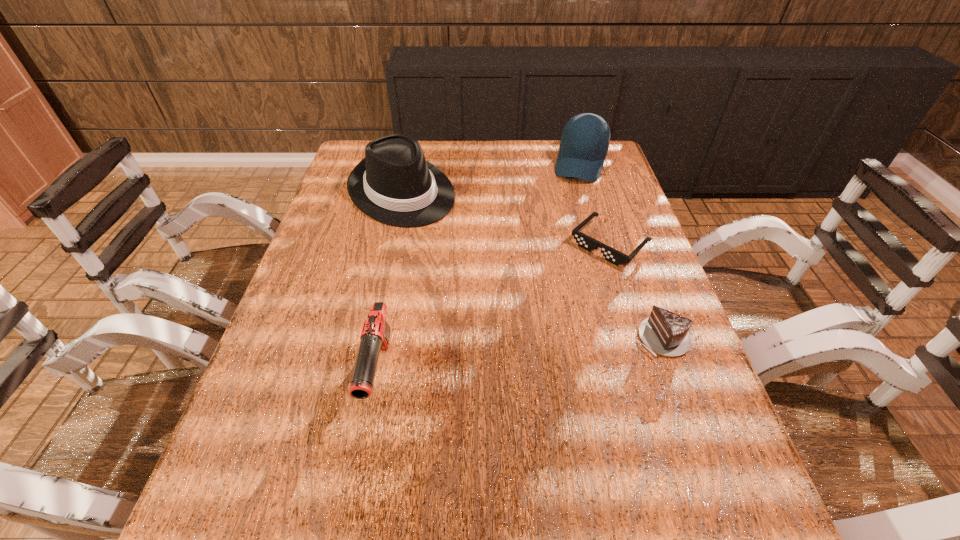
Where is `object that is the third nearest to the shortest object`? object that is the third nearest to the shortest object is located at coordinates (394, 184).